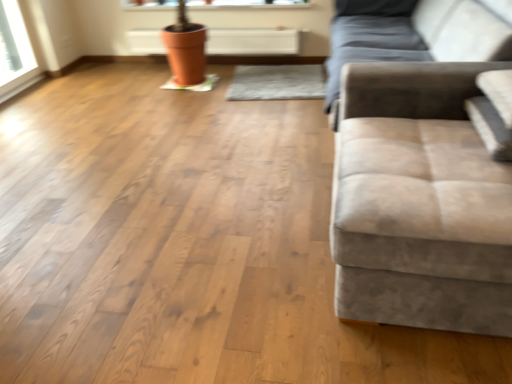
What do you see at coordinates (253, 42) in the screenshot?
I see `orange clay pot at upper center` at bounding box center [253, 42].

Locate an element on the screen. This screenshot has width=512, height=384. suede-like beige studio couch at right is located at coordinates (423, 184).

Describe the element at coordinates (246, 4) in the screenshot. This screenshot has width=512, height=384. I see `white glossy window sill at upper center` at that location.

The image size is (512, 384). Identify the location of orange clay pot at upper center. (253, 42).

Which is nearer, [153,36] or [145,5]?

Point [153,36] is farther from the camera than point [145,5].

Is the position of orange clay pot at upper center more distant than that of white glossy window sill at upper center?

No, it is in front of white glossy window sill at upper center.

Considering the relative sizes of orange clay pot at upper center and white glossy window sill at upper center in the image provided, is orange clay pot at upper center taller than white glossy window sill at upper center?

Yes.

Find the location of a particular element. The image size is (512, 384). window sill behind the orange clay pot at upper center is located at coordinates click(246, 4).

Which of these two, orange clay pot at upper center or suede-like beige studio couch at right, is thinner?

orange clay pot at upper center is thinner.

Considering the relative sizes of orange clay pot at upper center and suede-like beige studio couch at right in the image provided, is orange clay pot at upper center smaller than suede-like beige studio couch at right?

Correct, orange clay pot at upper center occupies less space than suede-like beige studio couch at right.

Can you tell me how much orange clay pot at upper center and suede-like beige studio couch at right differ in facing direction?

89.8 degrees.

In the image, is orange clay pot at upper center positioned in front of or behind suede-like beige studio couch at right?

Clearly, orange clay pot at upper center is behind suede-like beige studio couch at right.

Is suede-like beige studio couch at right bigger than orange clay pot at upper center?

Indeed, suede-like beige studio couch at right has a larger size compared to orange clay pot at upper center.

Considering the sizes of objects suede-like beige studio couch at right and orange clay pot at upper center in the image provided, who is taller, suede-like beige studio couch at right or orange clay pot at upper center?

With more height is suede-like beige studio couch at right.

Image resolution: width=512 pixels, height=384 pixels. In the image, there is a suede-like beige studio couch at right. Identify the location of radiator above it (from the image's perspective). (253, 42).

The image size is (512, 384). In order to click on window sill located on the left of suede-like beige studio couch at right in this screenshot , I will do `click(246, 4)`.

Does white glossy window sill at upper center come in front of suede-like beige studio couch at right?

That is False.

From the image's perspective, which object appears higher, white glossy window sill at upper center or suede-like beige studio couch at right?

white glossy window sill at upper center.

Which is behind, point (474, 188) or point (213, 2)?

The point (213, 2) is farther.

In terms of width, does suede-like beige studio couch at right look wider or thinner when compared to white glossy window sill at upper center?

In the image, suede-like beige studio couch at right appears to be wider than white glossy window sill at upper center.

Which object is positioned more to the left, suede-like beige studio couch at right or white glossy window sill at upper center?

From the viewer's perspective, white glossy window sill at upper center appears more on the left side.

Is white glossy window sill at upper center next to orange clay pot at upper center?

There is a gap between white glossy window sill at upper center and orange clay pot at upper center.

The height and width of the screenshot is (384, 512). Identify the location of window sill located on the left of orange clay pot at upper center. (246, 4).

Which is more to the left, white glossy window sill at upper center or orange clay pot at upper center?

white glossy window sill at upper center is more to the left.

At what (x,y) coordinates should I click in order to perform the action: click on radiator located in front of the white glossy window sill at upper center. Please return your answer as a coordinate pair (x, y). Looking at the image, I should click on (253, 42).

Find the location of `radiator that appears on the left of suede-like beige studio couch at right`. radiator that appears on the left of suede-like beige studio couch at right is located at coordinates (253, 42).

Which object lies nearer to the anchor point white glossy window sill at upper center, suede-like beige studio couch at right or orange clay pot at upper center?

orange clay pot at upper center.

Estimate the real-world distances between objects in this image. Which object is further from white glossy window sill at upper center, orange clay pot at upper center or suede-like beige studio couch at right?

Based on the image, suede-like beige studio couch at right appears to be further to white glossy window sill at upper center.

Looking at the image, which one is located further to suede-like beige studio couch at right, orange clay pot at upper center or white glossy window sill at upper center?

white glossy window sill at upper center.

Estimate the real-world distances between objects in this image. Which object is closer to suede-like beige studio couch at right, white glossy window sill at upper center or orange clay pot at upper center?

orange clay pot at upper center is positioned closer to the anchor suede-like beige studio couch at right.

Considering their positions, is white glossy window sill at upper center positioned closer to orange clay pot at upper center than suede-like beige studio couch at right?

white glossy window sill at upper center is positioned closer to the anchor orange clay pot at upper center.

Considering their positions, is suede-like beige studio couch at right positioned closer to orange clay pot at upper center than white glossy window sill at upper center?

Among the two, white glossy window sill at upper center is located nearer to orange clay pot at upper center.

Identify the location of radiator positioned between suede-like beige studio couch at right and white glossy window sill at upper center from near to far. (253, 42).